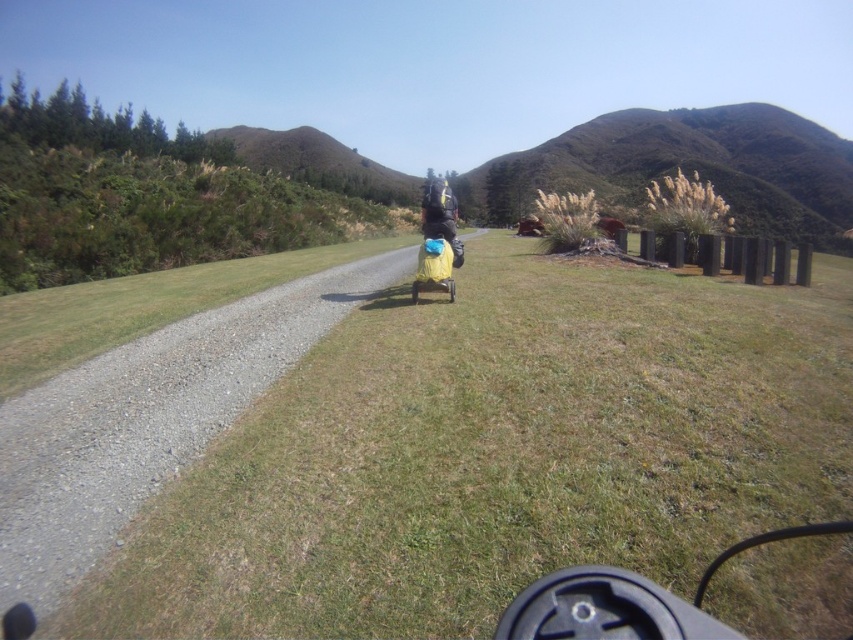
Question: From the image, what is the correct spatial relationship of green grassy at center in relation to matte black backpack at center?

Choices:
 (A) below
 (B) above

Answer: (A)

Question: Is green grassy at center wider than matte black backpack at center?

Choices:
 (A) no
 (B) yes

Answer: (B)

Question: Does green grassy at center have a lesser width compared to matte black backpack at center?

Choices:
 (A) yes
 (B) no

Answer: (B)

Question: Which object is closer to the camera taking this photo?

Choices:
 (A) matte black backpack at center
 (B) green grassy at center

Answer: (B)

Question: Which point is farther to the camera?

Choices:
 (A) green grassy at center
 (B) matte black backpack at center

Answer: (B)